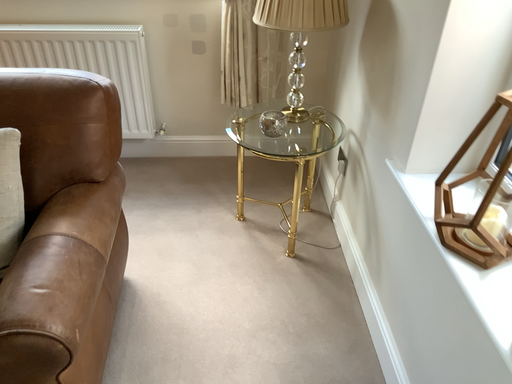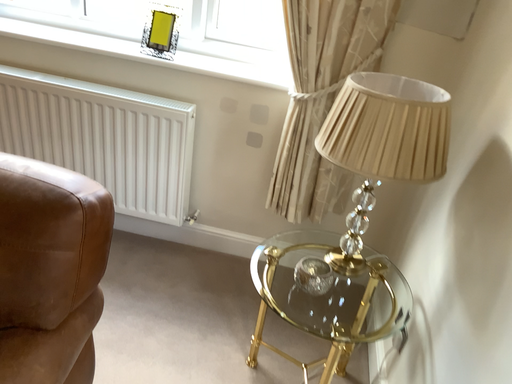
Question: Which way did the camera rotate in the video?

Choices:
 (A) rotated left
 (B) rotated right

Answer: (A)